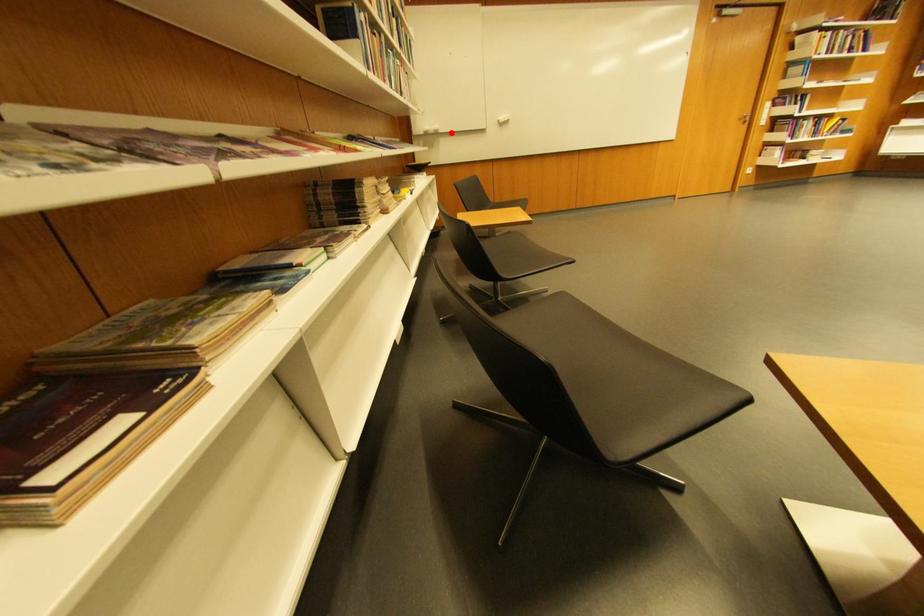
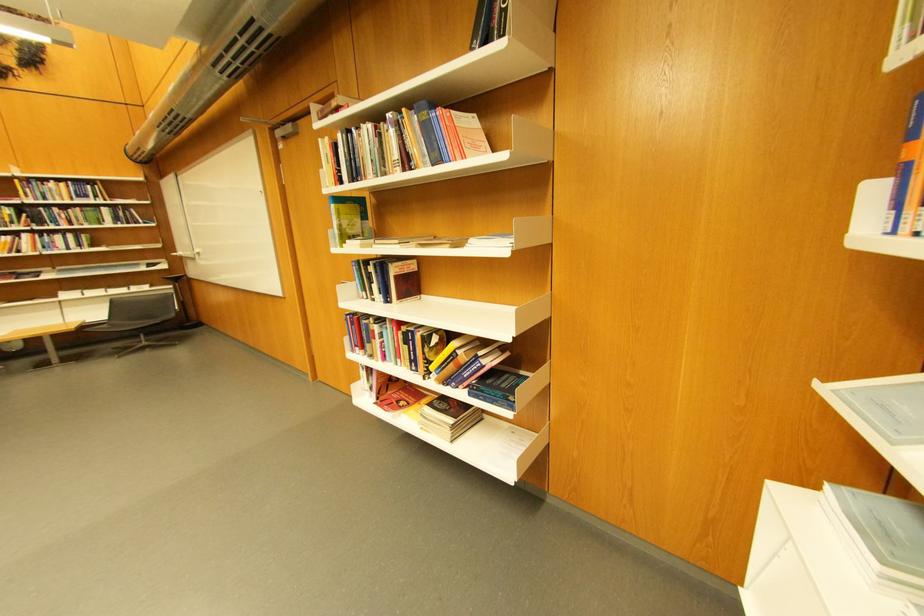
The point at the highlighted location is marked in the first image. Where is the corresponding point in the second image?

(195, 257)